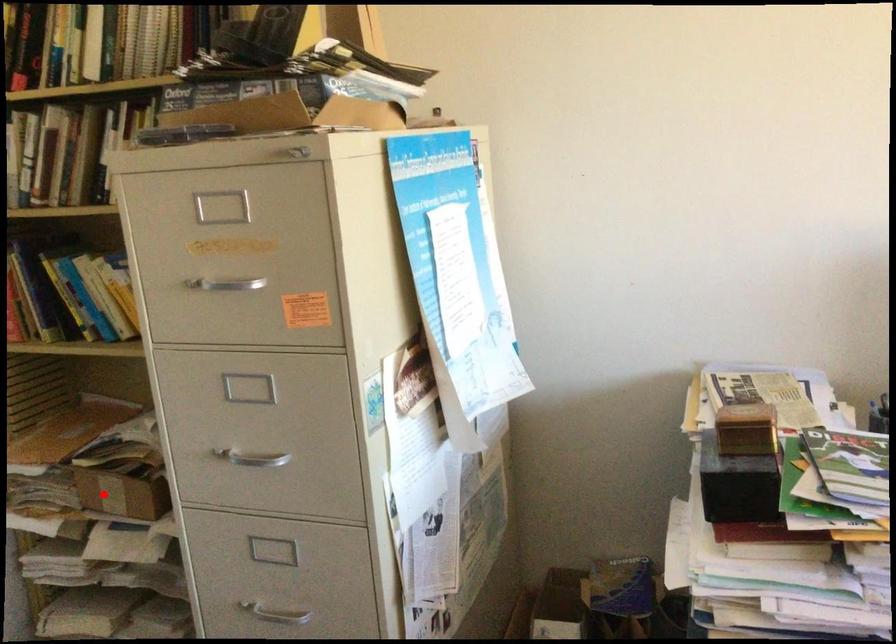
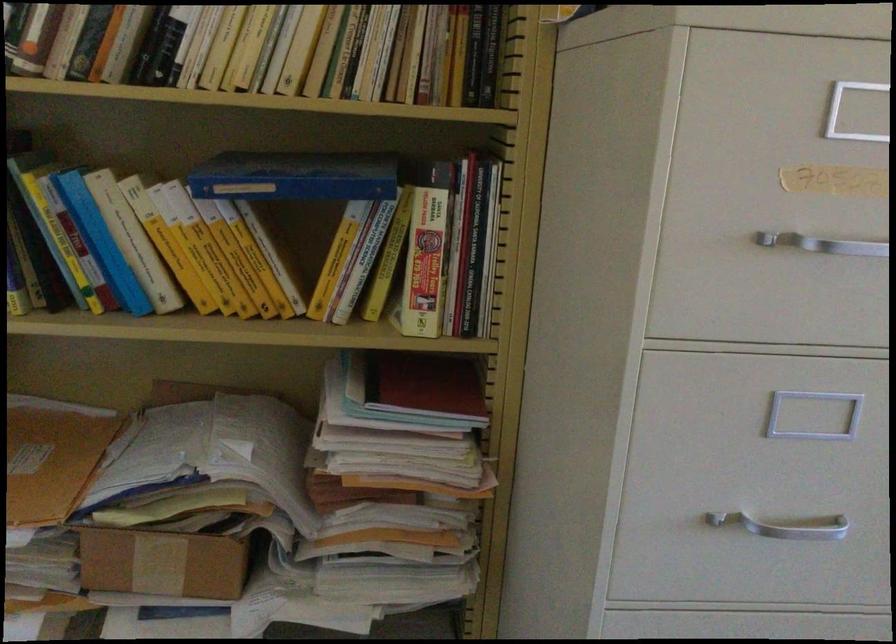
Question: I am providing you with two images of the same scene from different viewpoints. A red point is shown in image1. For the corresponding object point in image2, is it positioned nearer or farther from the camera?

Choices:
 (A) Nearer
 (B) Farther

Answer: (A)